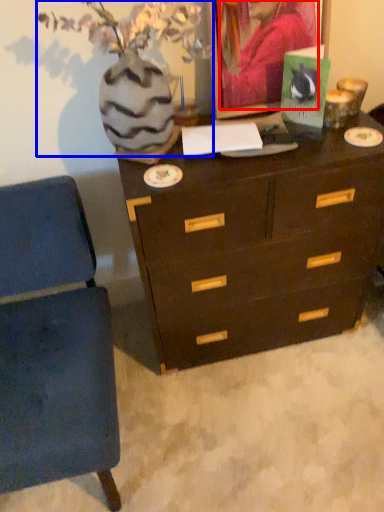
Question: Which of the following is the farthest to the observer, person (highlighted by a red box) or floral arrangement (highlighted by a blue box)?

Choices:
 (A) person
 (B) floral arrangement

Answer: (A)